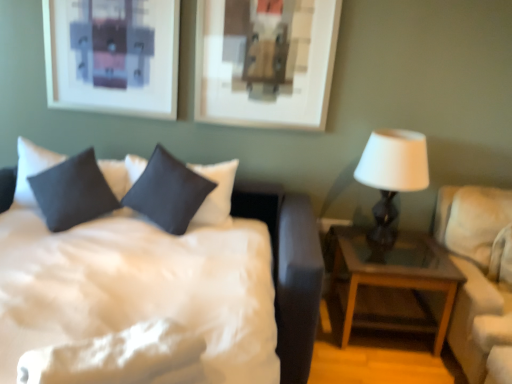
Question: Is satin dark blue pillow at center, placed as the 1th pillow when sorted from right to left, taller or shorter than white satin bed at center?

Choices:
 (A) short
 (B) tall

Answer: (A)

Question: Visually, is satin dark blue pillow at center, arranged as the 2th pillow when viewed from the left, positioned to the left or to the right of white satin bed at center?

Choices:
 (A) right
 (B) left

Answer: (A)

Question: Estimate the real-world distances between objects in this image. Which object is closer to the white satin bed at center?

Choices:
 (A) dark gray fabric pillow at upper left, marked as the first pillow in a left-to-right arrangement
 (B) satin dark blue pillow at center, arranged as the 2th pillow when viewed from the left
 (C) wooden nightstand at right
 (D) beige fabric couch at right
 (E) white matte table lamp at right

Answer: (B)

Question: Which of these objects is positioned closest to the dark gray fabric pillow at upper left, which ranks as the second pillow in right-to-left order?

Choices:
 (A) satin dark blue pillow at center, arranged as the 2th pillow when viewed from the left
 (B) beige fabric couch at right
 (C) wooden nightstand at right
 (D) white satin bed at center
 (E) white matte table lamp at right

Answer: (A)